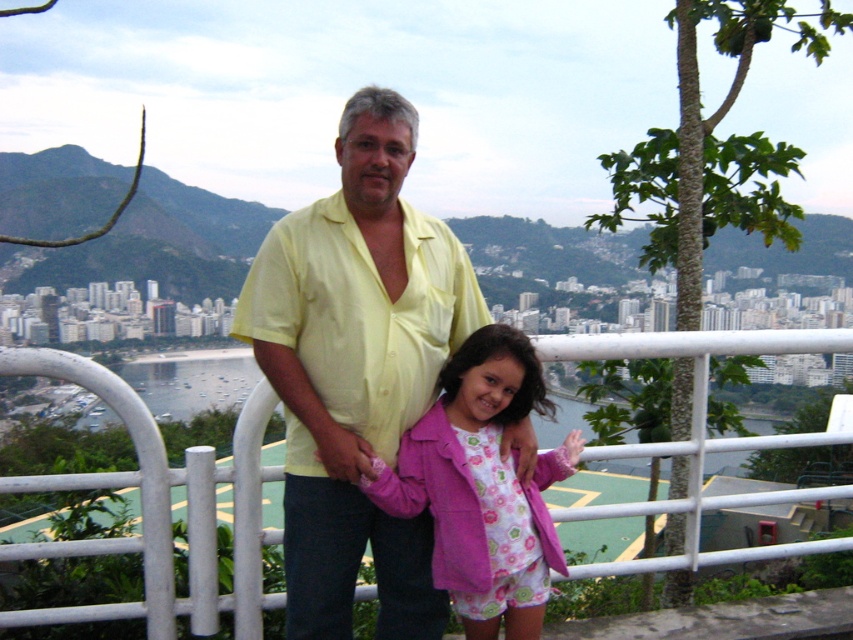
Which is more to the left, yellow smooth shirt at center or pink fabric jacket at center?

yellow smooth shirt at center is more to the left.

Does yellow smooth shirt at center appear over pink fabric jacket at center?

Indeed, yellow smooth shirt at center is positioned over pink fabric jacket at center.

Find the location of a particular element. The image size is (853, 640). yellow smooth shirt at center is located at coordinates (357, 369).

Between point (448, 330) and point (364, 595), which one is positioned in front?

Point (364, 595)

What do you see at coordinates (357, 369) in the screenshot?
I see `yellow smooth shirt at center` at bounding box center [357, 369].

Where is `yellow smooth shirt at center`? yellow smooth shirt at center is located at coordinates (357, 369).

Is white metal fence at center thinner than pink fabric jacket at center?

No, white metal fence at center is not thinner than pink fabric jacket at center.

Does white metal fence at center appear over pink fabric jacket at center?

Indeed, white metal fence at center is positioned over pink fabric jacket at center.

Find the location of a particular element. The height and width of the screenshot is (640, 853). white metal fence at center is located at coordinates point(158,509).

Where is `white metal fence at center`? Image resolution: width=853 pixels, height=640 pixels. white metal fence at center is located at coordinates (158, 509).